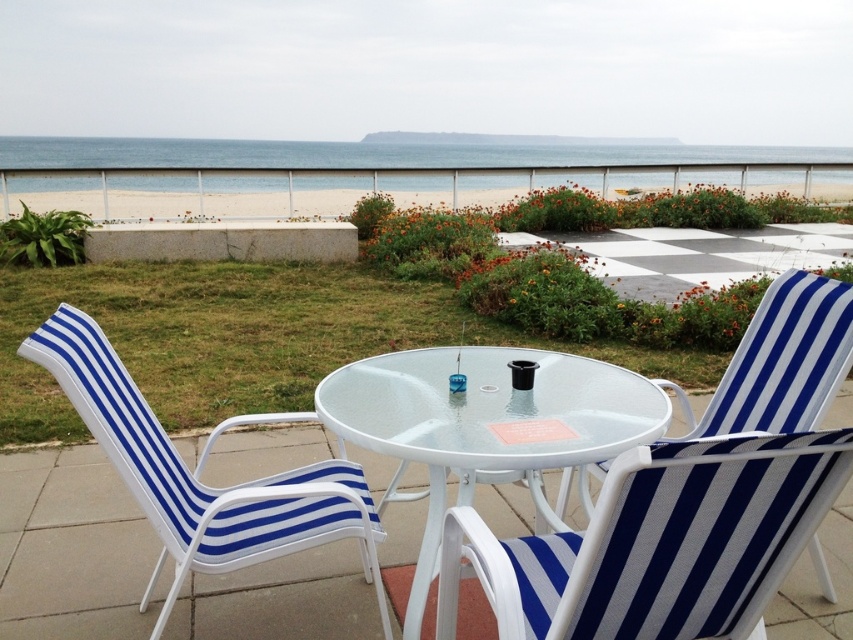
Can you confirm if blue striped fabric beach chair at left is positioned below white sand at upper center?

Correct, blue striped fabric beach chair at left is located below white sand at upper center.

Measure the distance between blue striped fabric beach chair at left and white sand at upper center.

They are 8.86 meters apart.

Is point (172, 589) positioned before point (701, 188)?

Yes.

The image size is (853, 640). Find the location of `blue striped fabric beach chair at left`. blue striped fabric beach chair at left is located at coordinates (195, 476).

Is blue striped fabric chair at center to the left of white sand at upper center from the viewer's perspective?

No, blue striped fabric chair at center is not to the left of white sand at upper center.

Who is lower down, blue striped fabric chair at center or white sand at upper center?

blue striped fabric chair at center

Between point (724, 422) and point (799, 204), which one is positioned in front?

Point (724, 422) is in front.

Image resolution: width=853 pixels, height=640 pixels. What are the coordinates of `blue striped fabric chair at center` in the screenshot? It's located at point(780,362).

Does blue striped fabric beach chair at left have a greater height compared to blue striped fabric chair at center?

Yes, blue striped fabric beach chair at left is taller than blue striped fabric chair at center.

Does blue striped fabric beach chair at left have a smaller size compared to blue striped fabric chair at center?

Actually, blue striped fabric beach chair at left might be larger than blue striped fabric chair at center.

Where is `blue striped fabric beach chair at left`? blue striped fabric beach chair at left is located at coordinates (195, 476).